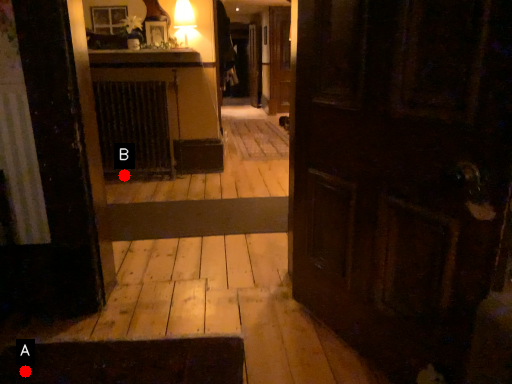
Question: Two points are circled on the image, labeled by A and B beside each circle. Which point is further to the camera?

Choices:
 (A) A is further
 (B) B is further

Answer: (B)